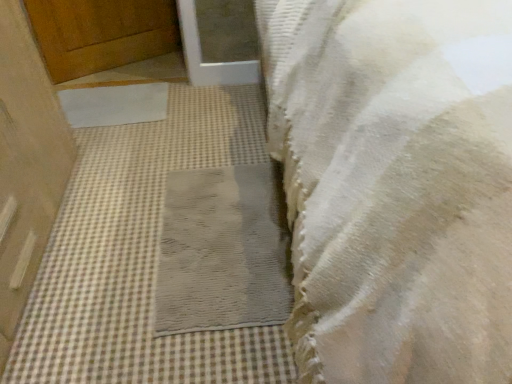
The width and height of the screenshot is (512, 384). I want to click on unoccupied area in front of white matte mat at center, the second mat in the right-to-left sequence, so click(x=119, y=148).